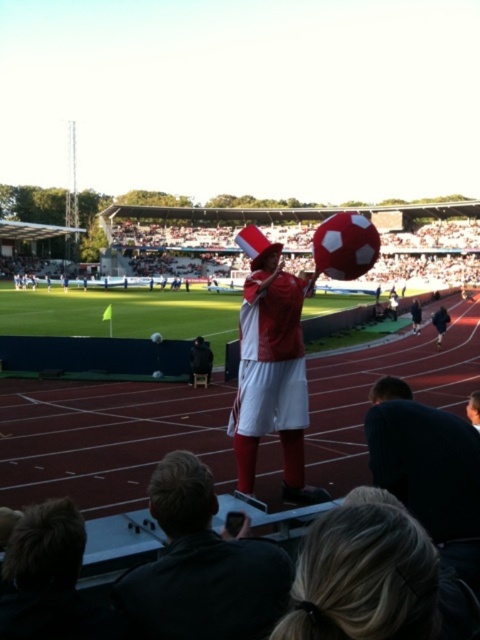
You are a photographer at the stadium and need to capture both the matte black jacket at center and the dark blue fabric jacket at center in a single shot. Which jacket should you focus on first to ensure both are in frame?

You should focus on the matte black jacket at center first because it is smaller in size compared to the dark blue fabric jacket at center, so you can adjust the camera to include both by zooming out slightly.

You are a drone operator tasked with capturing aerial footage of the sports stadium. Your drone has a maximum range of 50 meters. You need to fly the drone from the matte black jacket at center to the dark blue fabric jacket at center. Will the drone be able to make this flight without exceeding its range?

The distance between the matte black jacket at center and the dark blue fabric jacket at center is 44.46 meters, which is within the drone operator drone maximum range of 50 meters. The drone can safely make this flight without exceeding its range.

You are a photographer standing at the edge of the soccer field. You want to take a photo that includes both the matte red hat at center and the dark blue fabric jacket at center. Which object will appear larger in your photo?

The matte red hat at center will appear larger in the photo because it is closer to the viewer than the dark blue fabric jacket at center.